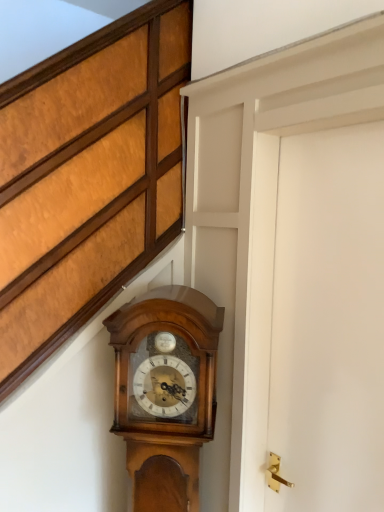
Question: Should I look upward or downward to see polished wood wall clock at center?

Choices:
 (A) down
 (B) up

Answer: (A)

Question: Is polished wood wall clock at center oriented away from white matte door at right?

Choices:
 (A) no
 (B) yes

Answer: (A)

Question: Is polished wood wall clock at center far from white matte door at right?

Choices:
 (A) no
 (B) yes

Answer: (A)

Question: From a real-world perspective, is polished wood wall clock at center on top of white matte door at right?

Choices:
 (A) yes
 (B) no

Answer: (B)

Question: Is polished wood wall clock at center outside of white matte door at right?

Choices:
 (A) yes
 (B) no

Answer: (A)

Question: Considering the relative sizes of polished wood wall clock at center and white matte door at right in the image provided, is polished wood wall clock at center taller than white matte door at right?

Choices:
 (A) yes
 (B) no

Answer: (B)

Question: Can you confirm if polished wood wall clock at center is shorter than white matte door at right?

Choices:
 (A) no
 (B) yes

Answer: (B)

Question: Does white matte door at right appear on the right side of polished wood wall clock at center?

Choices:
 (A) no
 (B) yes

Answer: (B)

Question: Is white matte door at right shorter than polished wood wall clock at center?

Choices:
 (A) no
 (B) yes

Answer: (A)

Question: Is white matte door at right further to camera compared to polished wood wall clock at center?

Choices:
 (A) no
 (B) yes

Answer: (A)

Question: Can you confirm if white matte door at right is positioned to the left of polished wood wall clock at center?

Choices:
 (A) yes
 (B) no

Answer: (B)

Question: Does white matte door at right have a smaller size compared to polished wood wall clock at center?

Choices:
 (A) yes
 (B) no

Answer: (A)

Question: Is white matte door at right surrounding polished wood wall clock at center?

Choices:
 (A) no
 (B) yes

Answer: (A)

Question: From the image's perspective, is polished wood wall clock at center positioned above or below white matte door at right?

Choices:
 (A) above
 (B) below

Answer: (B)